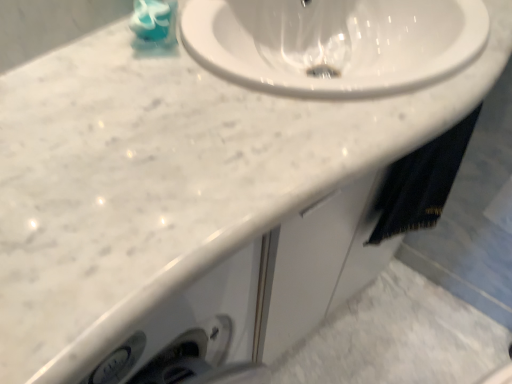
Question: Would you say teal glossy soap at upper left is inside or outside black fabric towel at lower right?

Choices:
 (A) outside
 (B) inside

Answer: (A)

Question: Is teal glossy soap at upper left to the left or to the right of black fabric towel at lower right in the image?

Choices:
 (A) left
 (B) right

Answer: (A)

Question: In the image, is teal glossy soap at upper left positioned in front of or behind black fabric towel at lower right?

Choices:
 (A) front
 (B) behind

Answer: (A)

Question: From a real-world perspective, is black fabric towel at lower right positioned above or below teal glossy soap at upper left?

Choices:
 (A) below
 (B) above

Answer: (A)

Question: Do you think black fabric towel at lower right is within teal glossy soap at upper left, or outside of it?

Choices:
 (A) outside
 (B) inside

Answer: (A)

Question: Is black fabric towel at lower right in front of or behind teal glossy soap at upper left in the image?

Choices:
 (A) behind
 (B) front

Answer: (A)

Question: Considering the positions of point (463, 120) and point (170, 9), is point (463, 120) closer or farther from the camera than point (170, 9)?

Choices:
 (A) farther
 (B) closer

Answer: (A)